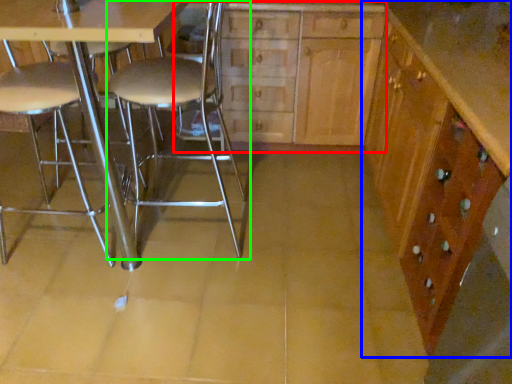
Question: Based on their relative distances, which object is farther from dresser (highlighted by a red box)? Choose from cabinetry (highlighted by a blue box) and chair (highlighted by a green box).

Choices:
 (A) cabinetry
 (B) chair

Answer: (A)